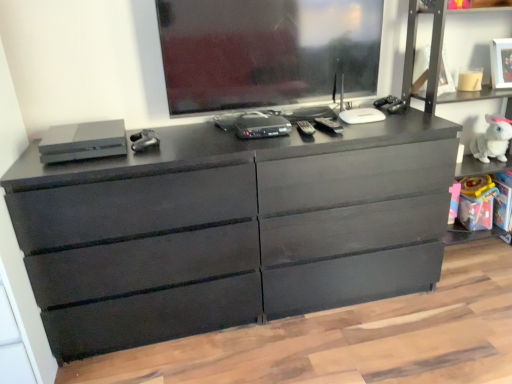
Question: From a real-world perspective, is satin gray console at left, marked as the 3th equipment in a right-to-left arrangement, below white plush rabbit at right?

Choices:
 (A) no
 (B) yes

Answer: (A)

Question: Is the depth of satin gray console at left, marked as the 3th equipment in a right-to-left arrangement, less than that of white plush rabbit at right?

Choices:
 (A) yes
 (B) no

Answer: (A)

Question: Would you consider satin gray console at left, marked as the 3th equipment in a right-to-left arrangement, to be distant from white plush rabbit at right?

Choices:
 (A) no
 (B) yes

Answer: (B)

Question: Considering the relative sizes of satin gray console at left, the first equipment viewed from the left, and white plush rabbit at right in the image provided, is satin gray console at left, the first equipment viewed from the left, taller than white plush rabbit at right?

Choices:
 (A) no
 (B) yes

Answer: (A)

Question: Is satin gray console at left, the first equipment viewed from the left, to the left of white plush rabbit at right from the viewer's perspective?

Choices:
 (A) yes
 (B) no

Answer: (A)

Question: Looking at their shapes, would you say white plush rabbit at right is wider or thinner than black plastic remote control at center, which ranks as the third equipment in left-to-right order?

Choices:
 (A) wide
 (B) thin

Answer: (B)

Question: From a real-world perspective, relative to black plastic remote control at center, the 1th equipment when ordered from right to left, is white plush rabbit at right vertically above or below?

Choices:
 (A) above
 (B) below

Answer: (B)

Question: In terms of height, does white plush rabbit at right look taller or shorter compared to black plastic remote control at center, the 1th equipment when ordered from right to left?

Choices:
 (A) short
 (B) tall

Answer: (B)

Question: Does point (484, 153) appear closer or farther from the camera than point (331, 124)?

Choices:
 (A) farther
 (B) closer

Answer: (A)

Question: Considering their positions, is matte black controller at center, positioned as the 2th equipment in right-to-left order, located in front of or behind matte black dresser at center?

Choices:
 (A) front
 (B) behind

Answer: (B)

Question: Would you say matte black controller at center, marked as the 2th equipment in a left-to-right arrangement, is inside or outside matte black dresser at center?

Choices:
 (A) outside
 (B) inside

Answer: (B)

Question: From their relative heights in the image, would you say matte black controller at center, marked as the 2th equipment in a left-to-right arrangement, is taller or shorter than matte black dresser at center?

Choices:
 (A) short
 (B) tall

Answer: (A)

Question: Is point (152, 130) closer or farther from the camera than point (159, 248)?

Choices:
 (A) farther
 (B) closer

Answer: (A)

Question: From a real-world perspective, relative to satin gray console at left, marked as the 3th equipment in a right-to-left arrangement, is matte black controller at center, marked as the 2th equipment in a left-to-right arrangement, vertically above or below?

Choices:
 (A) above
 (B) below

Answer: (B)

Question: Is point (144, 135) closer or farther from the camera than point (44, 145)?

Choices:
 (A) farther
 (B) closer

Answer: (A)